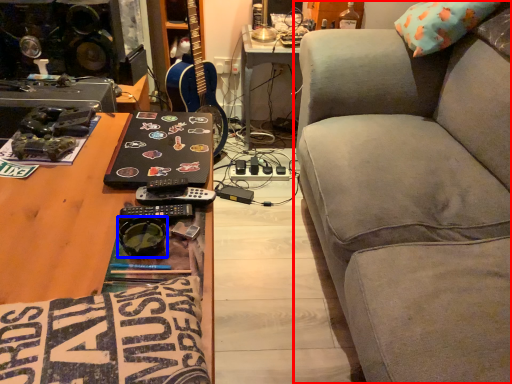
Question: Among these objects, which one is nearest to the camera, studio couch (highlighted by a red box) or goggles (highlighted by a blue box)?

Choices:
 (A) studio couch
 (B) goggles

Answer: (A)